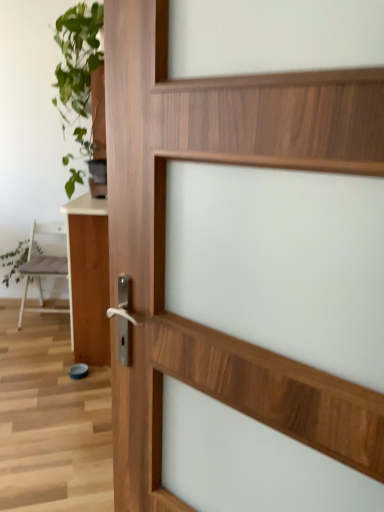
What is the approximate width of white matte chair at left?

The width of white matte chair at left is 20.20 inches.

Where is `white glossy table at left`? white glossy table at left is located at coordinates (88, 278).

This screenshot has height=512, width=384. I want to click on green leafy plant at left, so click(x=14, y=262).

Identify the location of houseplant that appears on the left of white glossy table at left. (78, 69).

From the image's perspective, is white glossy table at left under green leafy plant at upper left?

Yes, from the image's perspective, white glossy table at left is beneath green leafy plant at upper left.

Would you say white glossy table at left is a long distance from green leafy plant at upper left?

white glossy table at left is near green leafy plant at upper left, not far away.

Is green leafy plant at upper left facing towards green leafy plant at left?

No, green leafy plant at upper left is not aimed at green leafy plant at left.

From the image's perspective, is green leafy plant at upper left under green leafy plant at left?

No.

In the scene shown: Does green leafy plant at upper left have a greater width compared to green leafy plant at left?

Yes, green leafy plant at upper left is wider than green leafy plant at left.

Is green leafy plant at upper left with green leafy plant at left?

No.

Based on the photo, in terms of width, does green leafy plant at left look wider or thinner when compared to white glossy table at left?

green leafy plant at left is thinner than white glossy table at left.

Is green leafy plant at left located outside white glossy table at left?

Yes.

Between green leafy plant at left and white glossy table at left, which one has smaller size?

With smaller size is green leafy plant at left.

Considering the points (22, 246) and (32, 228), which point is in front, point (22, 246) or point (32, 228)?

The point (32, 228) is in front.

Is green leafy plant at left to the right of white matte chair at left from the viewer's perspective?

Incorrect, green leafy plant at left is not on the right side of white matte chair at left.

Do you think green leafy plant at left is within white matte chair at left, or outside of it?

green leafy plant at left exists outside the volume of white matte chair at left.

Locate an element on the screen. plant on the left of white matte chair at left is located at coordinates (14, 262).

Which point is more forward, (x=83, y=184) or (x=49, y=257)?

The point (x=83, y=184) is more forward.

Is green leafy plant at upper left wider or thinner than white matte chair at left?

Considering their sizes, green leafy plant at upper left looks broader than white matte chair at left.

Can we say green leafy plant at upper left lies outside white matte chair at left?

Yes, green leafy plant at upper left is located beyond the bounds of white matte chair at left.

What's the angular difference between green leafy plant at left and green leafy plant at upper left's facing directions?

The angular difference between green leafy plant at left and green leafy plant at upper left is 1.98 degrees.

Between green leafy plant at left and green leafy plant at upper left, which one has larger width?

green leafy plant at upper left.

I want to click on plant behind the green leafy plant at upper left, so click(14, 262).

Looking at this image, does green leafy plant at left have a smaller size compared to green leafy plant at upper left?

Indeed, green leafy plant at left has a smaller size compared to green leafy plant at upper left.

Considering the sizes of objects green leafy plant at upper left and white glossy table at left in the image provided, who is thinner, green leafy plant at upper left or white glossy table at left?

white glossy table at left.

The image size is (384, 512). In order to click on houseplant positioned vertically above the white glossy table at left (from a real-world perspective) in this screenshot , I will do `click(78, 69)`.

Is the depth of green leafy plant at upper left greater than that of white glossy table at left?

Yes, green leafy plant at upper left is further from the camera.

Who is bigger, green leafy plant at upper left or white glossy table at left?

Bigger between the two is green leafy plant at upper left.

The height and width of the screenshot is (512, 384). I want to click on table lying on the right of green leafy plant at upper left, so click(x=88, y=278).

Image resolution: width=384 pixels, height=512 pixels. I want to click on houseplant above the green leafy plant at left (from the image's perspective), so click(78, 69).

Considering their positions, is white glossy table at left positioned closer to green leafy plant at upper left than white matte chair at left?

The object closer to green leafy plant at upper left is white matte chair at left.

Which object lies nearer to the anchor point white matte chair at left, green leafy plant at left or green leafy plant at upper left?

green leafy plant at left lies closer to white matte chair at left than the other object.

Considering their positions, is white matte chair at left positioned closer to white glossy table at left than green leafy plant at upper left?

green leafy plant at upper left lies closer to white glossy table at left than the other object.

Looking at the image, which one is located further to white matte chair at left, green leafy plant at upper left or white glossy table at left?

white glossy table at left is positioned further to the anchor white matte chair at left.

Looking at the image, which one is located further to green leafy plant at upper left, green leafy plant at left or white matte chair at left?

green leafy plant at left lies further to green leafy plant at upper left than the other object.

In the scene shown: Looking at the image, which one is located closer to white glossy table at left, green leafy plant at left or green leafy plant at upper left?

The object closer to white glossy table at left is green leafy plant at upper left.

Looking at the image, which one is located closer to white matte chair at left, green leafy plant at upper left or green leafy plant at left?

The object closer to white matte chair at left is green leafy plant at left.

Which object lies further to the anchor point green leafy plant at left, green leafy plant at upper left or white matte chair at left?

green leafy plant at upper left lies further to green leafy plant at left than the other object.

Identify the location of chair between white glossy table at left and green leafy plant at left from front to back. The image size is (384, 512). (43, 267).

Locate an element on the screen. The image size is (384, 512). plant between green leafy plant at upper left and white glossy table at left vertically is located at coordinates (14, 262).

Locate an element on the screen. The image size is (384, 512). plant between green leafy plant at upper left and white matte chair at left in the up-down direction is located at coordinates (14, 262).

At what (x,y) coordinates should I click in order to perform the action: click on chair between green leafy plant at upper left and white glossy table at left in the up-down direction. Please return your answer as a coordinate pair (x, y). Looking at the image, I should click on (43, 267).